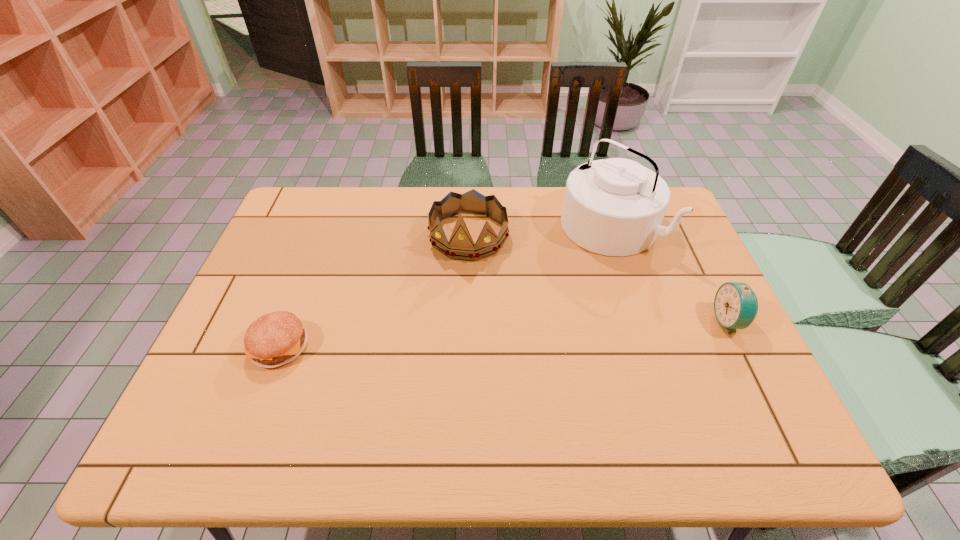
This screenshot has width=960, height=540. I want to click on free space on the desktop that is between the leftmost object and the alarm clock and is positioned on the spout of the second object from right to left, so click(x=456, y=336).

Identify the location of vacant space on the desktop that is between the hamburger and the rightmost object and is positioned at the front of the third shortest object with jewels. The image size is (960, 540). (444, 337).